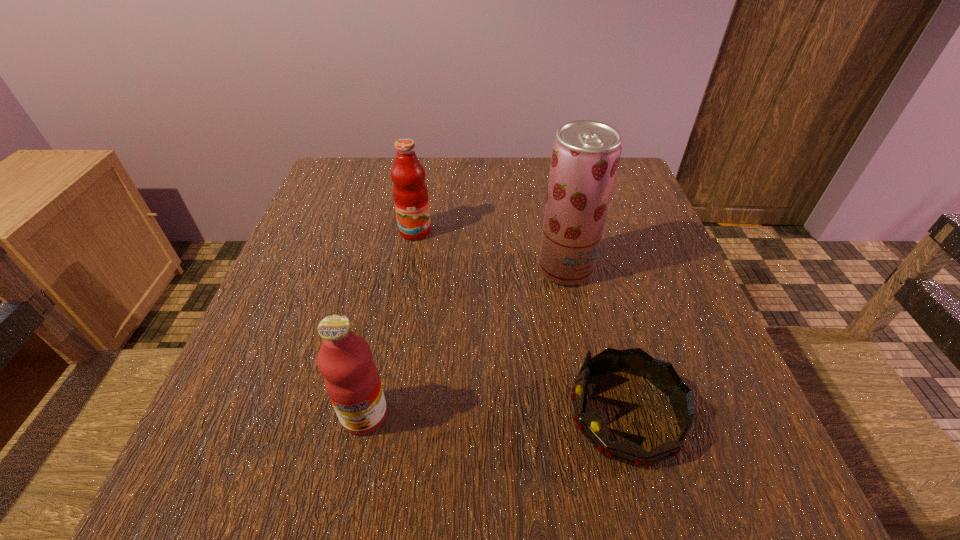
Where is `the tallest fruit juice`? The width and height of the screenshot is (960, 540). the tallest fruit juice is located at coordinates [585, 156].

Identify the location of the rightmost fruit juice. (585, 156).

Find the location of a particular element. The height and width of the screenshot is (540, 960). the farthest fruit juice is located at coordinates (410, 193).

Find the location of `the nearest fruit juice`. the nearest fruit juice is located at coordinates (351, 378).

This screenshot has height=540, width=960. I want to click on the shortest object, so click(x=592, y=424).

This screenshot has height=540, width=960. Identify the location of vacant space located 0.370m on the back of the rightmost fruit juice. (543, 162).

You are a GUI agent. You are given a task and a screenshot of the screen. Output one action in this format:
    pyautogui.click(x=<x>, y=<y>)
    Task: Click on the free region located on the front label of the farthest object
    
    Given the screenshot: What is the action you would take?
    394,362

Image resolution: width=960 pixels, height=540 pixels. I want to click on vacant region located on the label of the nearest fruit juice, so click(x=349, y=488).

Where is `blank space located at the front of the tiara with jewels`? This screenshot has width=960, height=540. blank space located at the front of the tiara with jewels is located at coordinates (382, 414).

I want to click on free region located at the front of the tiara with jewels, so click(x=516, y=414).